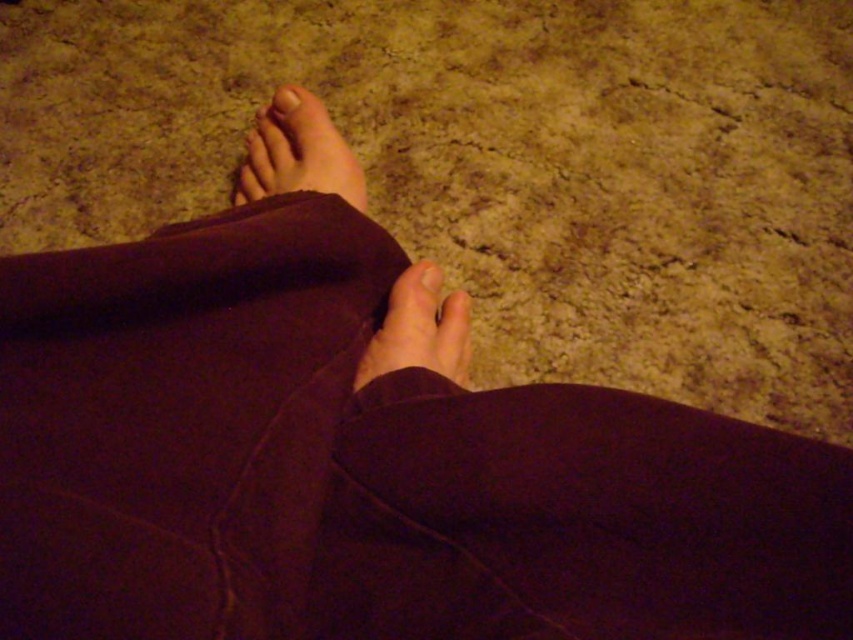
You are a photographer adjusting a lighting setup for a closeup shot of feet. You need to position a small light source to highlight the matte skin toe at upper center. According to the coordinates provided, where should you place the light relative to the toe?

The matte skin toe at upper center is located at coordinates point (285, 100). To highlight it effectively, position the light source near that coordinate point to ensure proper illumination.

You are a photographer adjusting your camera to focus on two points in the image of a person standing on a carpeted floor. The points are labeled as point (428, 292) and point (281, 100). Based on the scene, which point is closer to the camera?

Point (428, 292) is closer to the viewer than point (281, 100).

You are an artist trying to draw the smooth skin foot at center. Based on the coordinates provided, where should you place it in your drawing canvas?

The smooth skin foot at center should be placed at the coordinates point (419,332) on the canvas.